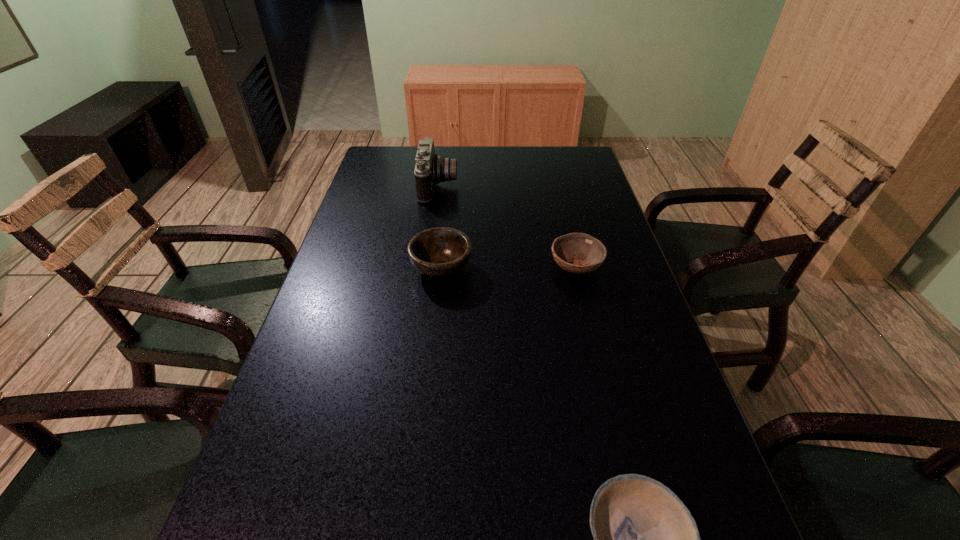
What are the coordinates of `the farthest object` in the screenshot? It's located at (430, 168).

Where is `the tallest object`? the tallest object is located at coordinates (430, 168).

Locate an element on the screen. the leftmost bowl is located at coordinates (438, 252).

Image resolution: width=960 pixels, height=540 pixels. What are the coordinates of `vacant point located on the front-facing side of the camera` in the screenshot? It's located at (516, 186).

You are a GUI agent. You are given a task and a screenshot of the screen. Output one action in this format:
    pyautogui.click(x=<x>, y=<y>)
    Task: Click on the free space located on the back of the leftmost bowl
    Image resolution: width=960 pixels, height=540 pixels.
    Given the screenshot: What is the action you would take?
    pyautogui.click(x=446, y=217)

Locate an element on the screen. object located in the far edge section of the desktop is located at coordinates (430, 168).

Image resolution: width=960 pixels, height=540 pixels. Find the location of `object located in the right edge section of the desktop`. object located in the right edge section of the desktop is located at coordinates (587, 253).

Find the location of a particular element. The width and height of the screenshot is (960, 540). vacant space at the far edge is located at coordinates (522, 174).

Locate an element on the screen. free space at the left edge of the desktop is located at coordinates (337, 412).

I want to click on vacant space at the right edge of the desktop, so click(x=577, y=230).